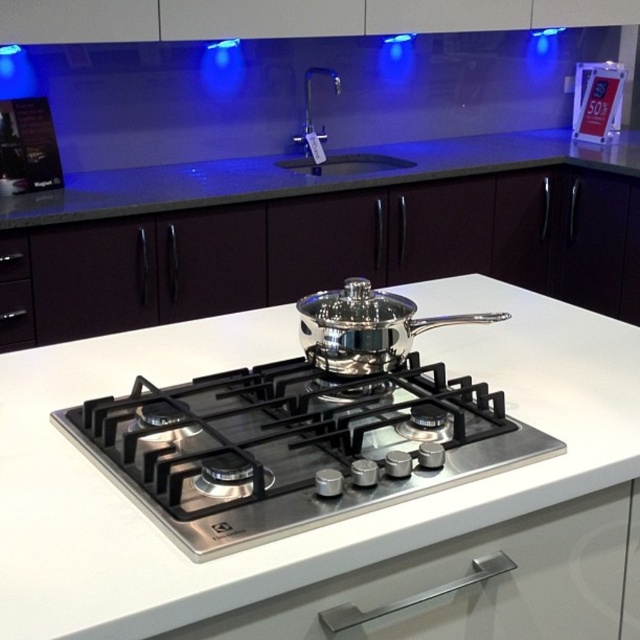
Question: Can you confirm if white glossy countertop at center is smaller than stainless steel gas stove at center?

Choices:
 (A) yes
 (B) no

Answer: (B)

Question: Which point is farther to the camera?

Choices:
 (A) (145, 392)
 (B) (444, 160)
 (C) (604, 460)
 (D) (20, 268)

Answer: (B)

Question: Which is farther from the metallic silver pot at upper right?

Choices:
 (A) black matte drawer at left
 (B) dark gray laminate countertop at center
 (C) stainless steel gas stove at center
 (D) white glossy countertop at center

Answer: (A)

Question: Is dark gray laminate countertop at center to the left of black matte drawer at left from the viewer's perspective?

Choices:
 (A) no
 (B) yes

Answer: (A)

Question: Among these objects, which one is nearest to the camera?

Choices:
 (A) stainless steel gas stove at center
 (B) black matte drawer at left
 (C) metallic silver pot at upper right
 (D) white glossy countertop at center

Answer: (D)

Question: Does stainless steel gas stove at center appear on the right side of dark gray laminate countertop at center?

Choices:
 (A) yes
 (B) no

Answer: (B)